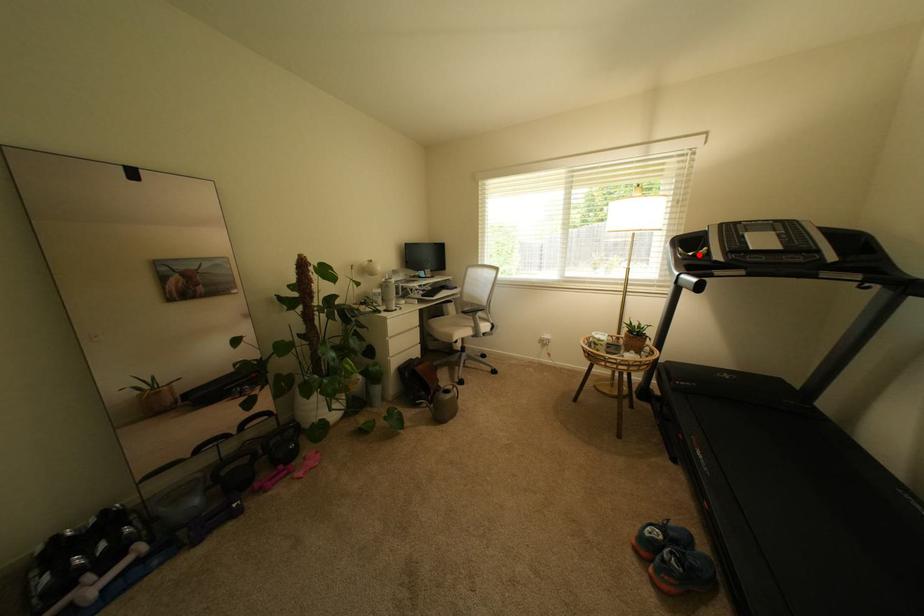
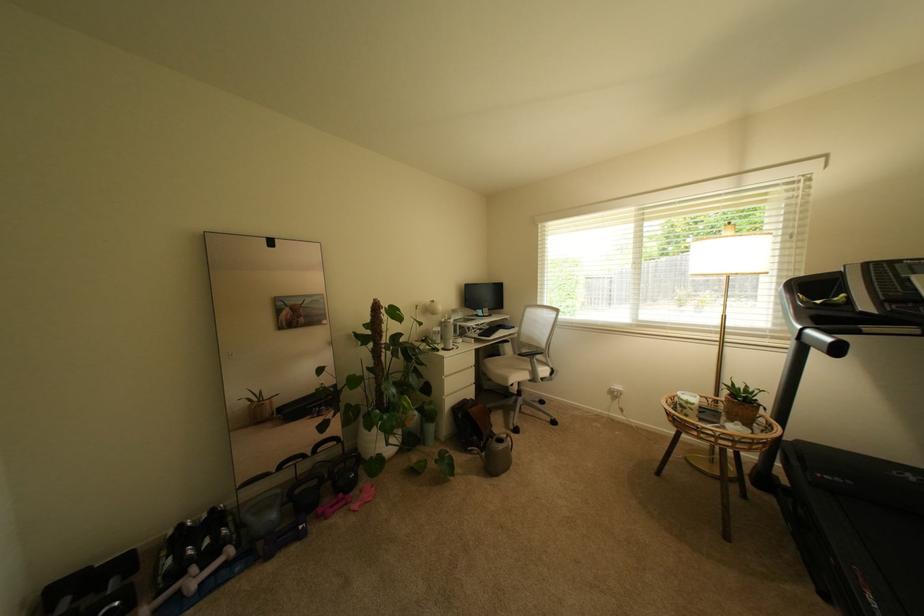
The point at the highlighted location is marked in the first image. Where is the corresponding point in the second image?

(827, 302)